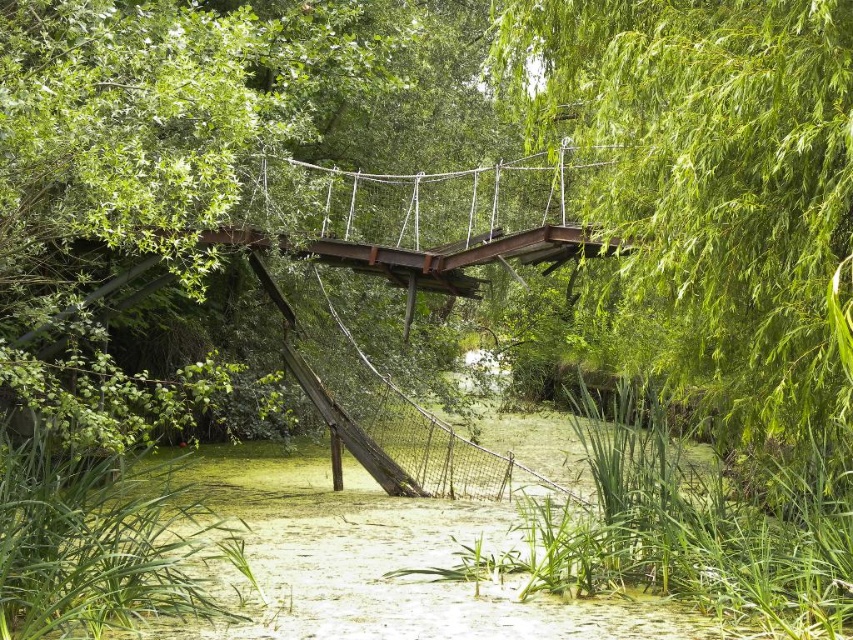
You are a hiker trying to cross the rusty metal suspension bridge at center. You notice a green leafy tree at upper right in the background. Which object appears narrower from your perspective?

The green leafy tree at upper right appears narrower than the rusty metal suspension bridge at center because it is thinner.

You are standing at the point labeled point (706, 180) on the dilapidated suspension bridge. Looking around, you notice dense vegetation all around. Which direction should you look to see the green leafy tree that the point is on?

The point (706, 180) is on the green leafy tree at upper right, so you should look toward the upper right direction to see the green leafy tree at upper right.